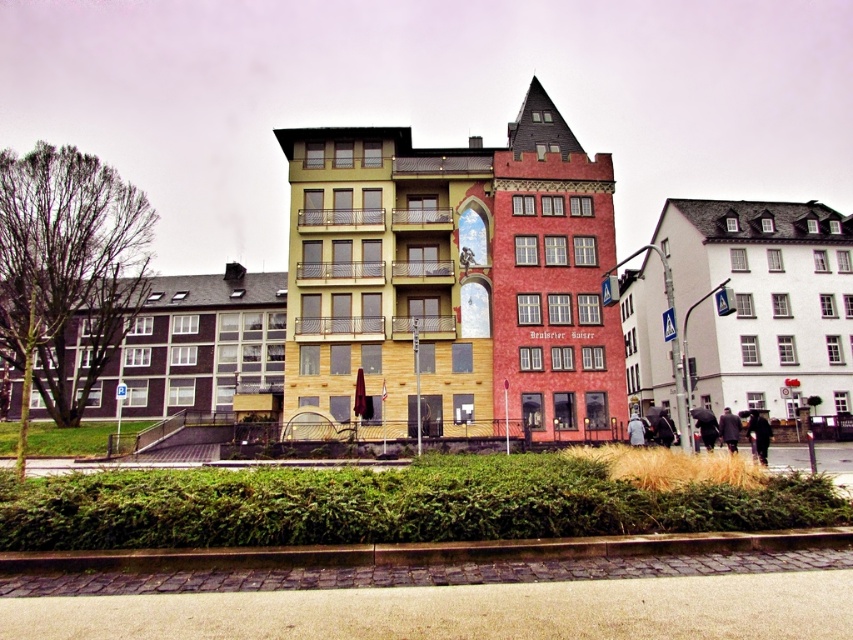
You are standing at a point 36.35 meters away from the point marked at coordinates (762, 451) in the image. If you want to walk directly towards that point, how far will you have to walk?

You will have to walk 36.35 meters to reach the point marked at coordinates (762, 451) since you are currently 36.35 meters away from it.

You are a delivery person trying to navigate through the urban scene shown. You need to place a large package between the green leafy hedge at lower center and the black leather jacket at lower right. Considering their sizes, will there be enough space for the package?

The green leafy hedge at lower center is wider than the black leather jacket at lower right. Since the hedge is wider, there might be sufficient space between them to place the large package, but the exact feasibility depends on the package dimensions compared to the available gap.

You are standing in the urban scene and want to take a photo of both point (761, 429) and point (729, 449). Which point will appear larger in your camera view?

Point (761, 429) is closer to the camera than point (729, 449), so it will appear larger in the camera view.